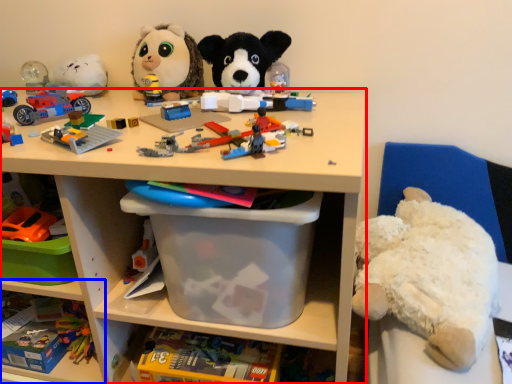
Question: Which of the following is the closest to the observer, shelf (highlighted by a red box) or shelf (highlighted by a blue box)?

Choices:
 (A) shelf
 (B) shelf

Answer: (A)